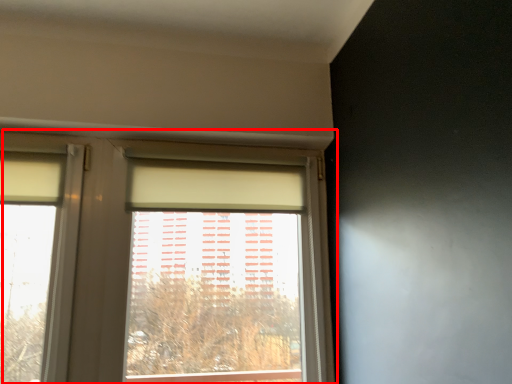
Question: Considering the relative positions of window (annotated by the red box) and curtain in the image provided, where is window (annotated by the red box) located with respect to the staircase?

Choices:
 (A) left
 (B) right

Answer: (B)